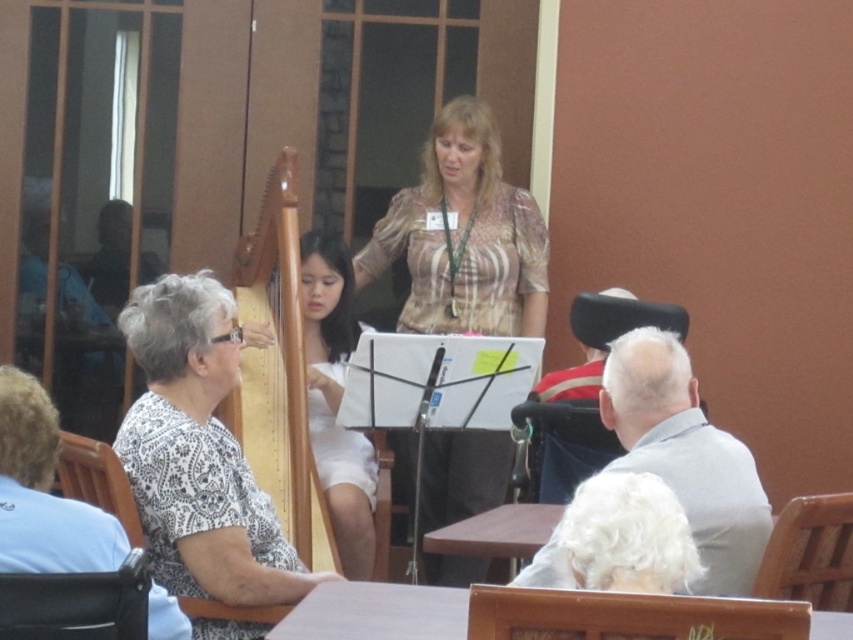
Question: From the image, what is the correct spatial relationship of patterned fabric blouse at center in relation to white fabric dress at center?

Choices:
 (A) below
 (B) above

Answer: (B)

Question: Is white dotted shirt at left bigger than patterned fabric blouse at center?

Choices:
 (A) no
 (B) yes

Answer: (B)

Question: Which object is the farthest from the white fabric dress at center?

Choices:
 (A) white dotted shirt at left
 (B) patterned fabric blouse at center

Answer: (A)

Question: Which point is closer to the camera?

Choices:
 (A) patterned fabric blouse at center
 (B) white dotted shirt at left
 (C) white fabric dress at center

Answer: (B)

Question: Does white dotted shirt at left appear under patterned fabric blouse at center?

Choices:
 (A) no
 (B) yes

Answer: (B)

Question: Among these objects, which one is nearest to the camera?

Choices:
 (A) white dotted shirt at left
 (B) white fabric dress at center

Answer: (A)